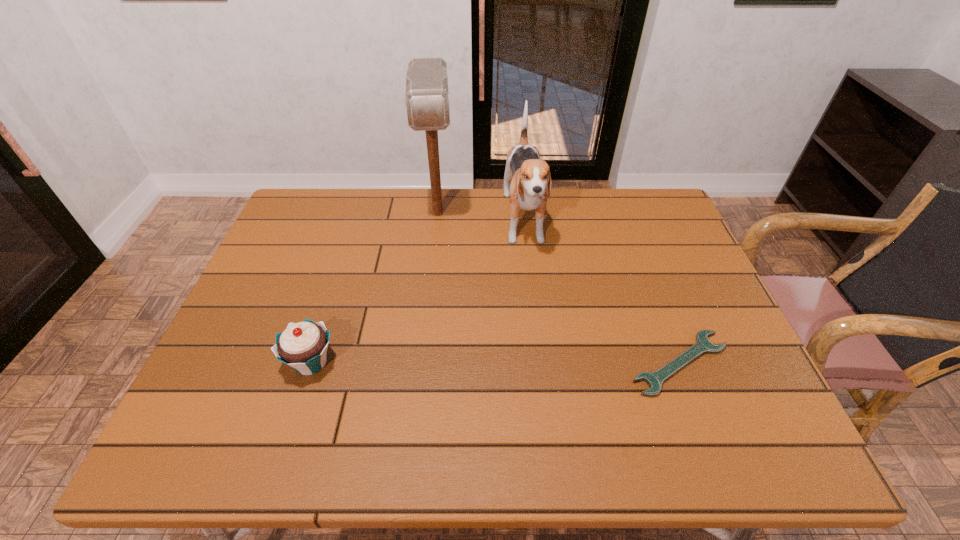
Locate an element on the screen. This screenshot has height=540, width=960. free space between the second tallest object and the cupcake is located at coordinates (418, 293).

Locate an element on the screen. vacant space that is in between the cupcake and the third object from left to right is located at coordinates (418, 293).

This screenshot has width=960, height=540. What are the coordinates of `free space between the third object from right to left and the cupcake` in the screenshot? It's located at (374, 288).

Locate an element on the screen. The image size is (960, 540). free space between the mallet and the wrench is located at coordinates (559, 288).

Locate an element on the screen. This screenshot has height=540, width=960. free area in between the wrench and the leftmost object is located at coordinates (495, 363).

Identify the location of empty space that is in between the leftmost object and the rightmost object. (495, 363).

You are a GUI agent. You are given a task and a screenshot of the screen. Output one action in this format:
    pyautogui.click(x=<x>, y=<y>)
    Task: Click on the unoccupied position between the puppy and the leftmost object
    
    Given the screenshot: What is the action you would take?
    pyautogui.click(x=418, y=293)

Find the location of a particular element. The image size is (960, 540). free space between the mallet and the cupcake is located at coordinates (374, 288).

Find the location of a particular element. object that ranks as the second closest to the puppy is located at coordinates (702, 345).

Locate which object is the closest to the rightmost object. Please provide its 2D coordinates. Your answer should be formatted as a tuple, i.e. [(x, y)], where the tuple contains the x and y coordinates of a point satisfying the conditions above.

[(530, 176)]